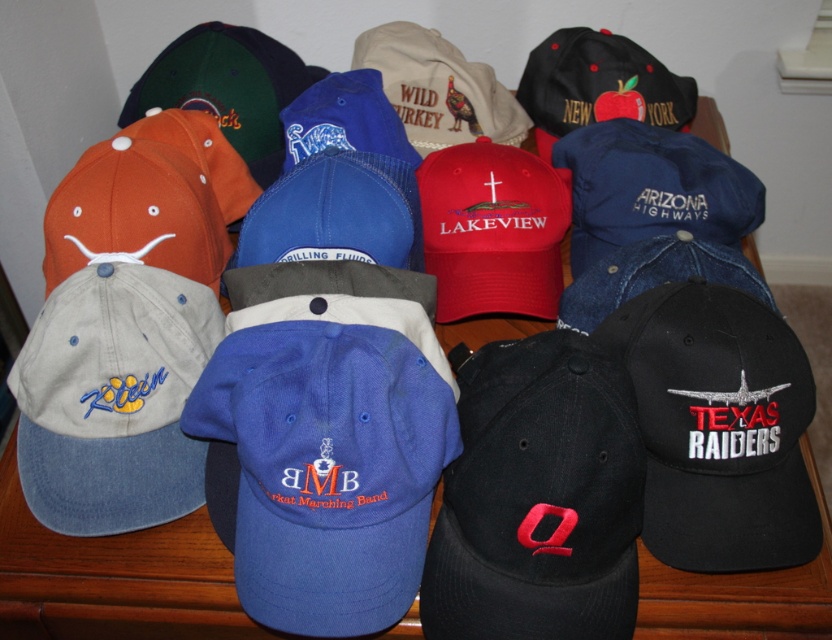
You are organizing a display of baseball caps and need to determine their height for proper stacking. Which of the two caps, the gray denim baseball cap at left or the orange fabric baseball cap at left, has a greater height?

The gray denim baseball cap at left is taller than the orange fabric baseball cap at left, so it has a greater height.

Consider the image. What is the 2D coordinate of the gray denim baseball cap at left?

The 2D coordinate of the gray denim baseball cap at left is at point (112, 397).

You are organizing a display of baseball caps on a shelf. You have a gray denim baseball cap at left and an orange fabric baseball cap at left. According to the arrangement in the image, which cap is positioned lower on the shelf?

The gray denim baseball cap at left is positioned lower on the shelf because it is below the orange fabric baseball cap at left.